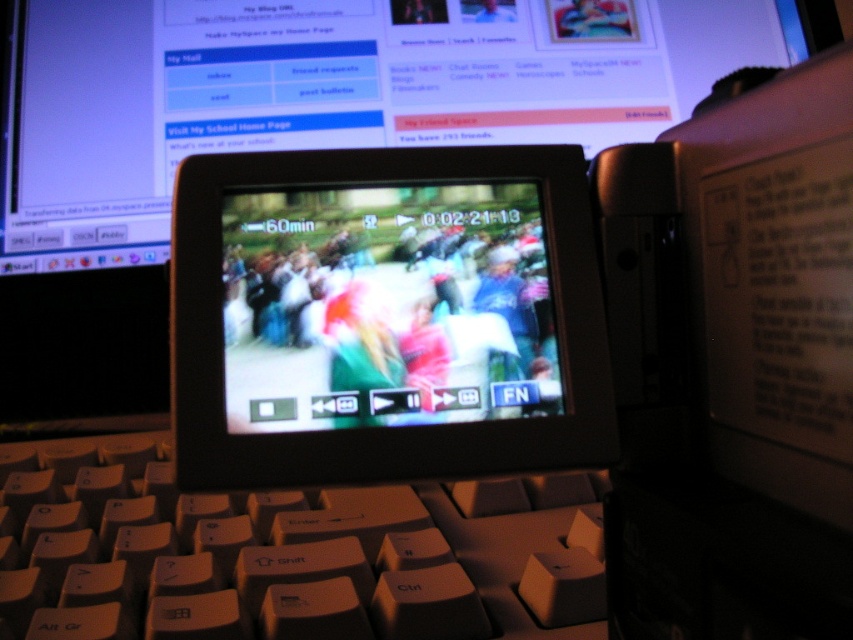
Between black glossy screen at center and beige plastic keyboard at center, which one appears on the right side from the viewer's perspective?

black glossy screen at center is more to the right.

Does black glossy screen at center have a larger size compared to beige plastic keyboard at center?

No, black glossy screen at center is not bigger than beige plastic keyboard at center.

Is point (367, 150) less distant than point (178, 560)?

Yes, it is.

Find the location of a particular element. black glossy screen at center is located at coordinates (386, 316).